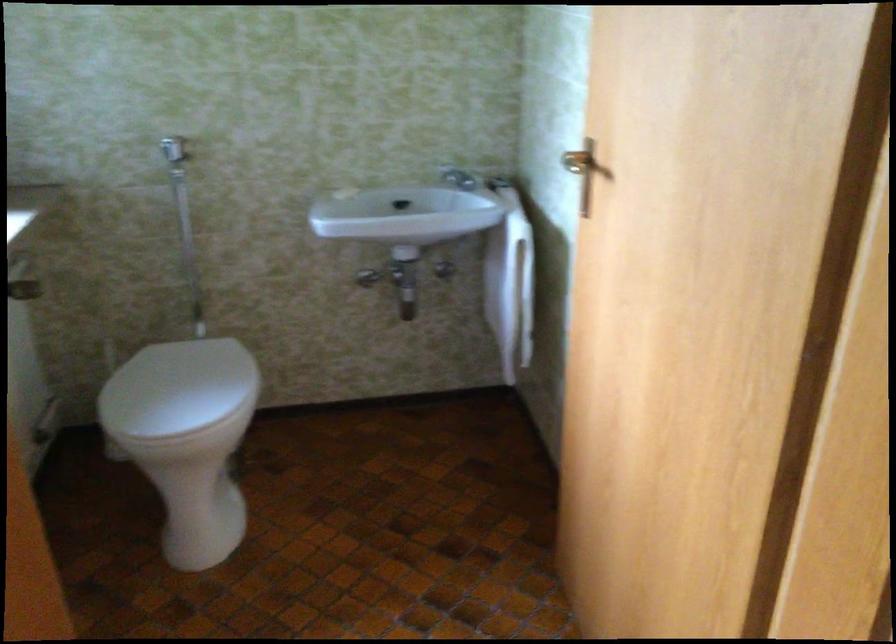
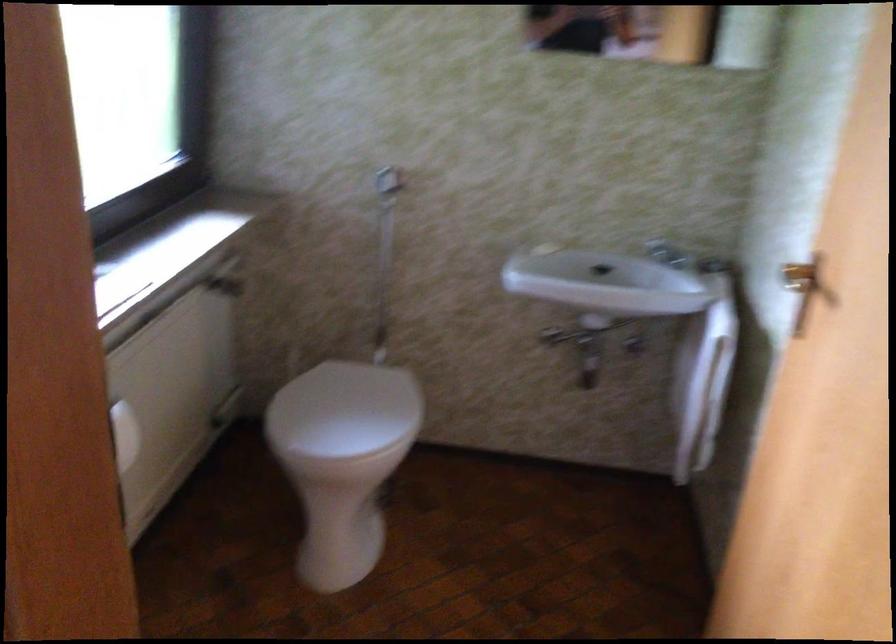
Question: How did the camera likely rotate?

Choices:
 (A) Left
 (B) Right
 (C) Up
 (D) Down

Answer: (A)